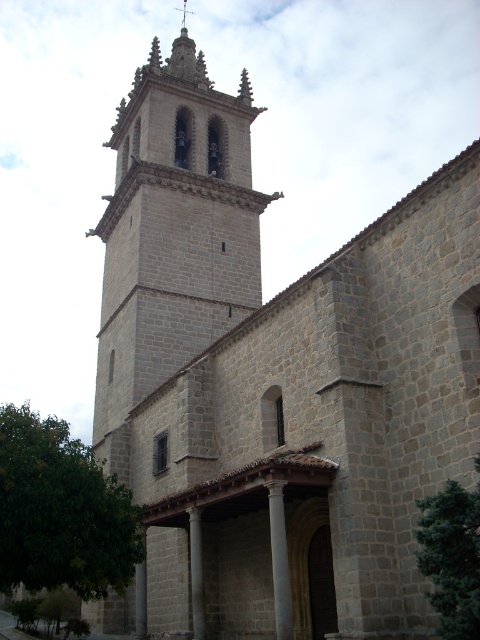
You are an architect planning to add a new statue between the gray stone pillar at center and the gray stone pillar at lower center. Which pillar should the statue be placed closer to if you want it to align with the thinner pillar?

The statue should be placed closer to the gray stone pillar at center because it is thinner than the gray stone pillar at lower center.